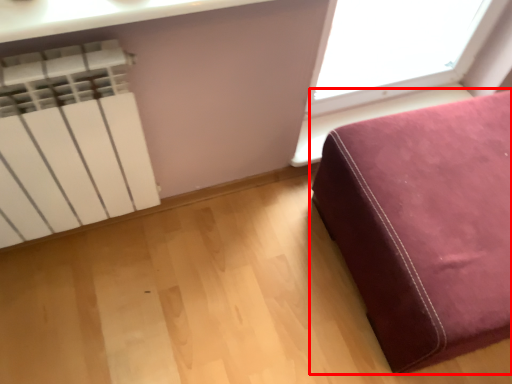
Question: Observing the image, what is the correct spatial positioning of furniture (annotated by the red box) in reference to radiator?

Choices:
 (A) left
 (B) right

Answer: (B)